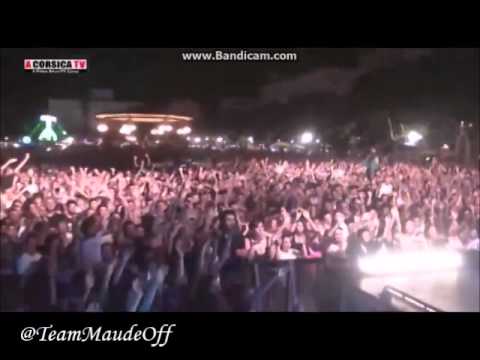
Identify the location of stage. This screenshot has width=480, height=360. (418, 282).